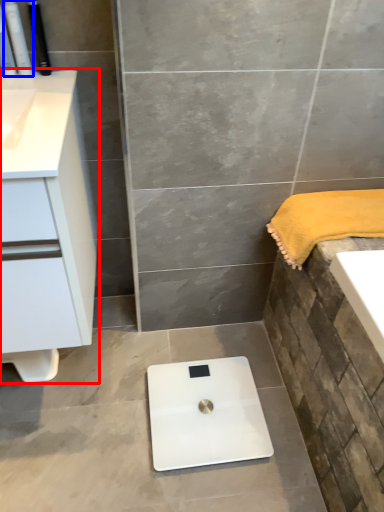
Question: Which object is further to the camera taking this photo, bathroom cabinet (highlighted by a red box) or toiletry (highlighted by a blue box)?

Choices:
 (A) bathroom cabinet
 (B) toiletry

Answer: (B)